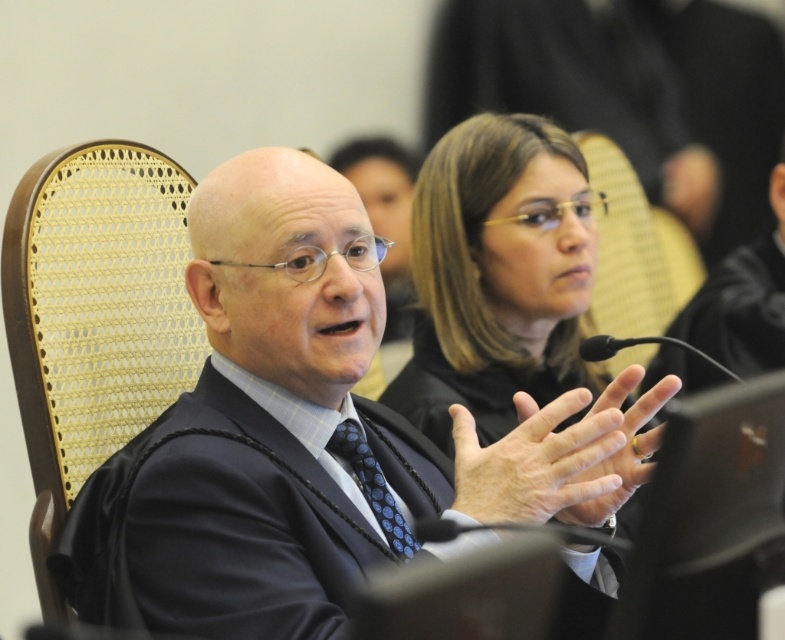
Between matte black robe at center and woven cane chair at left, which one appears on the left side from the viewer's perspective?

From the viewer's perspective, woven cane chair at left appears more on the left side.

Does matte black robe at center appear over woven cane chair at left?

Yes, matte black robe at center is above woven cane chair at left.

Who is more distant from viewer, (437, 330) or (64, 394)?

The point (437, 330) is more distant.

The width and height of the screenshot is (785, 640). What are the coordinates of `matte black robe at center` in the screenshot? It's located at (513, 296).

Is matte black suit at center thinner than matte black robe at center?

No.

Which is above, matte black suit at center or matte black robe at center?

Positioned higher is matte black robe at center.

This screenshot has width=785, height=640. Describe the element at coordinates (291, 432) in the screenshot. I see `matte black suit at center` at that location.

At what (x,y) coordinates should I click in order to perform the action: click on matte black suit at center. Please return your answer as a coordinate pair (x, y). This screenshot has width=785, height=640. Looking at the image, I should click on (291, 432).

Who is higher up, matte black suit at center or gold ring at center?

Positioned higher is gold ring at center.

Does matte black suit at center have a lesser width compared to gold ring at center?

No.

Between point (199, 602) and point (625, 374), which one is positioned behind?

Point (625, 374)

At what (x,y) coordinates should I click in order to perform the action: click on matte black suit at center. Please return your answer as a coordinate pair (x, y). This screenshot has width=785, height=640. Looking at the image, I should click on (291, 432).